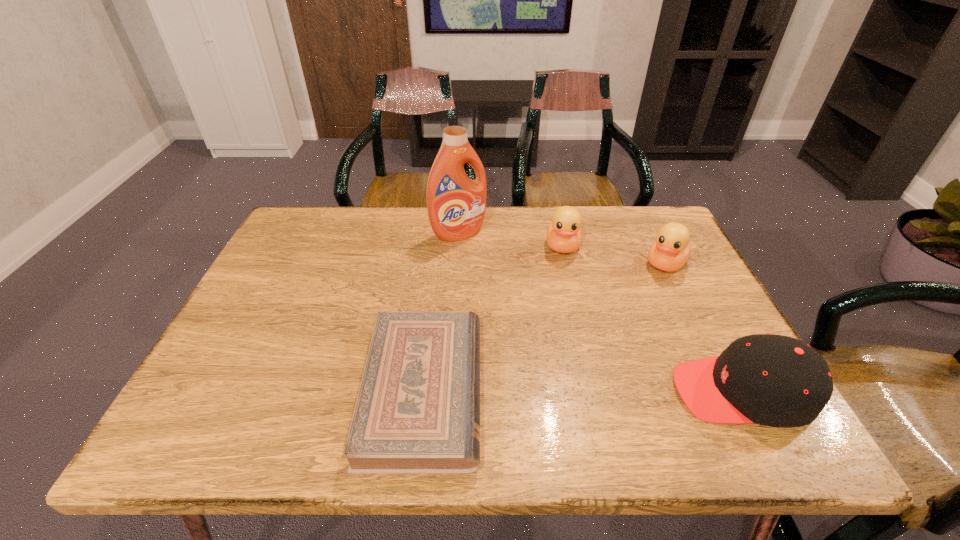
Locate an element on the screen. This screenshot has width=960, height=540. vacant region located 0.270m on the face of the left duckling is located at coordinates (562, 334).

You are a GUI agent. You are given a task and a screenshot of the screen. Output one action in this format:
    pyautogui.click(x=<x>, y=<y>)
    Task: Click on the vacant space located 0.230m on the face of the left duckling
    The height and width of the screenshot is (540, 960).
    Given the screenshot: What is the action you would take?
    pyautogui.click(x=562, y=321)

Locate an element on the screen. The image size is (960, 540). vacant region located 0.100m on the face of the right duckling is located at coordinates (645, 297).

Find the location of a particular element. Image resolution: width=960 pixels, height=540 pixels. vacant space located 0.280m on the face of the right duckling is located at coordinates (617, 341).

Image resolution: width=960 pixels, height=540 pixels. Identify the location of free region located 0.340m on the face of the right duckling. (607, 359).

Where is `vacant region located 0.260m on the front-facing side of the detergent`? This screenshot has width=960, height=540. vacant region located 0.260m on the front-facing side of the detergent is located at coordinates (516, 298).

In order to click on free spot located 0.190m on the front-facing side of the detergent in this screenshot , I will do `click(503, 281)`.

The image size is (960, 540). Find the location of `free region located on the front-facing side of the detergent`. free region located on the front-facing side of the detergent is located at coordinates (501, 279).

Image resolution: width=960 pixels, height=540 pixels. Find the location of `detergent at the far edge`. detergent at the far edge is located at coordinates (456, 205).

Locate an element on the screen. This screenshot has height=540, width=960. Bible located at the near edge is located at coordinates (417, 410).